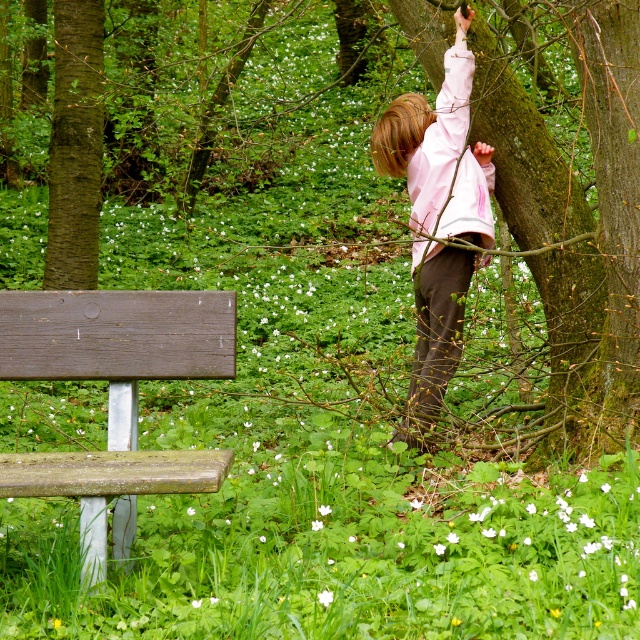
Is smooth bark tree at upper right below wooden bench at lower left?

No.

Which of these two, smooth bark tree at upper right or wooden bench at lower left, stands taller?

Standing taller between the two is smooth bark tree at upper right.

I want to click on smooth bark tree at upper right, so click(292, 230).

Who is higher up, wooden bench at lower left or pink fabric shirt at upper right?

pink fabric shirt at upper right is above.

Is wooden bench at lower left in front of pink fabric shirt at upper right?

Yes, wooden bench at lower left is closer to the viewer.

Is point (164, 458) positioned after point (438, 189)?

No, it is in front of (438, 189).

The image size is (640, 640). What are the coordinates of `wooden bench at lower left` in the screenshot? It's located at (115, 396).

Is the position of smooth bark tree at upper right less distant than that of pink fabric shirt at upper right?

That is True.

Does smooth bark tree at upper right appear on the left side of pink fabric shirt at upper right?

Indeed, smooth bark tree at upper right is positioned on the left side of pink fabric shirt at upper right.

What do you see at coordinates (292, 230) in the screenshot?
I see `smooth bark tree at upper right` at bounding box center [292, 230].

The height and width of the screenshot is (640, 640). Identify the location of smooth bark tree at upper right. (292, 230).